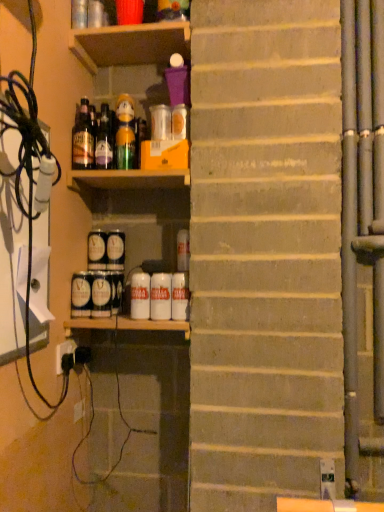
Question: Considering the relative sizes of green glass bottle at upper center, the 1th bottle when ordered from right to left, and matte glass bottle at upper left, arranged as the third bottle when viewed from the right, in the image provided, is green glass bottle at upper center, the 1th bottle when ordered from right to left, bigger than matte glass bottle at upper left, arranged as the third bottle when viewed from the right,?

Choices:
 (A) yes
 (B) no

Answer: (B)

Question: Is green glass bottle at upper center, the 1th bottle when ordered from right to left, oriented towards matte glass bottle at upper left, arranged as the third bottle when viewed from the right?

Choices:
 (A) no
 (B) yes

Answer: (A)

Question: From the image's perspective, is green glass bottle at upper center, the 3th bottle in the left-to-right sequence, beneath matte glass bottle at upper left, which is the first bottle from left to right?

Choices:
 (A) yes
 (B) no

Answer: (A)

Question: Is green glass bottle at upper center, the 3th bottle in the left-to-right sequence, not close to matte glass bottle at upper left, which is the first bottle from left to right?

Choices:
 (A) yes
 (B) no

Answer: (B)

Question: Does green glass bottle at upper center, the 1th bottle when ordered from right to left, have a greater width compared to matte glass bottle at upper left, arranged as the third bottle when viewed from the right?

Choices:
 (A) yes
 (B) no

Answer: (B)

Question: Considering the relative sizes of green glass bottle at upper center, the 1th bottle when ordered from right to left, and matte glass bottle at upper left, which is the first bottle from left to right, in the image provided, is green glass bottle at upper center, the 1th bottle when ordered from right to left, shorter than matte glass bottle at upper left, which is the first bottle from left to right,?

Choices:
 (A) yes
 (B) no

Answer: (A)

Question: Is matte black can at center, which is the fifth beverage in right-to-left order, behind matte glass bottle at upper left, which is the first bottle from left to right?

Choices:
 (A) yes
 (B) no

Answer: (A)

Question: Is matte black can at center, the 4th beverage positioned from the left, shorter than matte glass bottle at upper left, which is the first bottle from left to right?

Choices:
 (A) yes
 (B) no

Answer: (A)

Question: Could you tell me if matte black can at center, the 4th beverage positioned from the left, is turned towards matte glass bottle at upper left, arranged as the third bottle when viewed from the right?

Choices:
 (A) no
 (B) yes

Answer: (A)

Question: Is matte black can at center, which is the fifth beverage in right-to-left order, bigger than matte glass bottle at upper left, arranged as the third bottle when viewed from the right?

Choices:
 (A) no
 (B) yes

Answer: (A)

Question: From a real-world perspective, is matte black can at center, which is the fifth beverage in right-to-left order, beneath matte glass bottle at upper left, arranged as the third bottle when viewed from the right?

Choices:
 (A) yes
 (B) no

Answer: (A)

Question: Is matte black can at center, which is the fifth beverage in right-to-left order, looking in the opposite direction of matte glass bottle at upper left, arranged as the third bottle when viewed from the right?

Choices:
 (A) yes
 (B) no

Answer: (B)

Question: From the image's perspective, does white matte can at center, marked as the 3th beverage in a right-to-left arrangement, appear lower than matte black can at center, the first beverage in the left-to-right sequence?

Choices:
 (A) yes
 (B) no

Answer: (A)